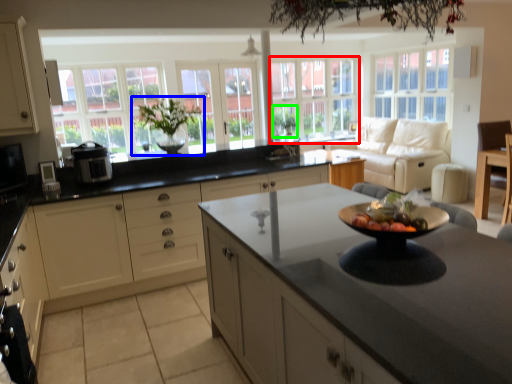
Question: Based on their relative distances, which object is nearer to window (highlighted by a red box)? Choose from houseplant (highlighted by a blue box) and plant (highlighted by a green box).

Choices:
 (A) houseplant
 (B) plant

Answer: (B)